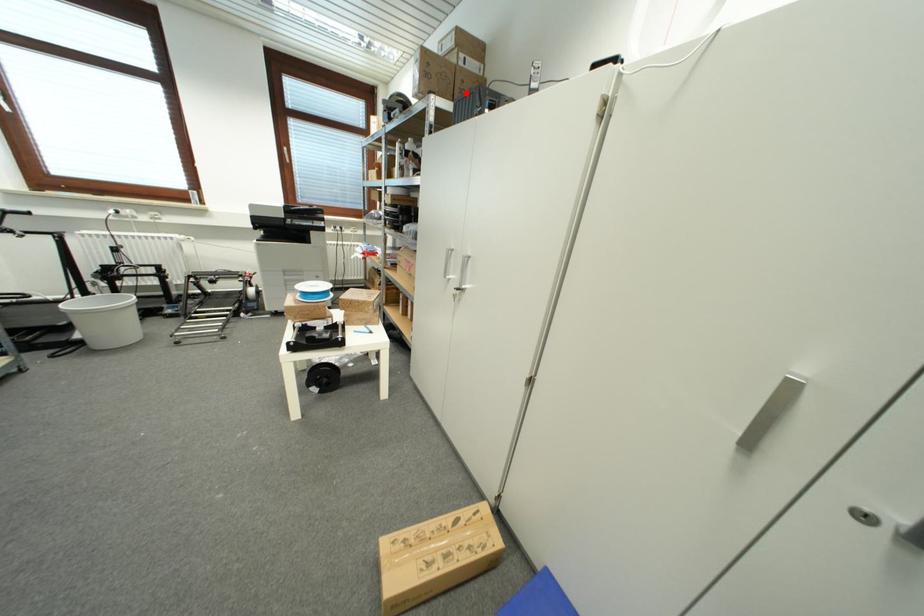
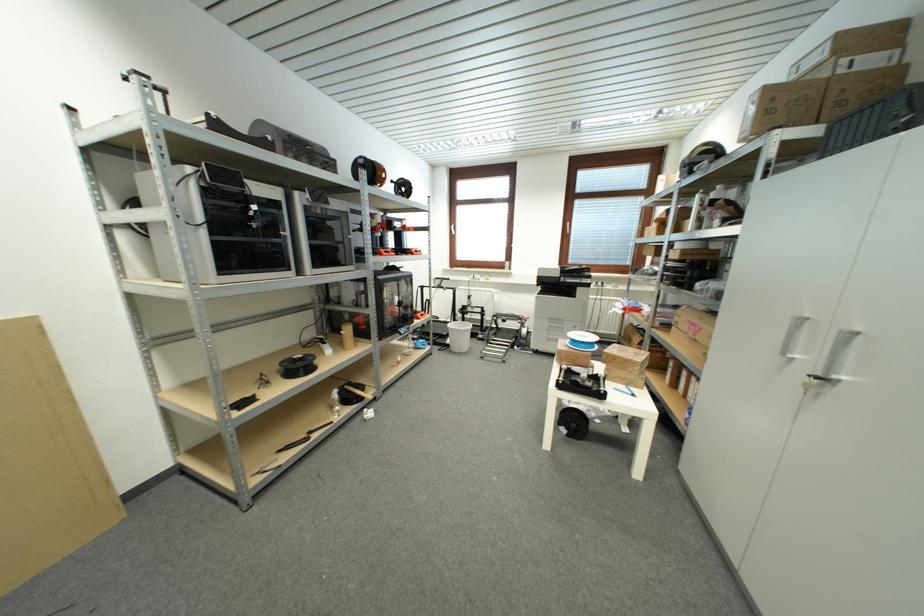
Locate, in the second image, the point that corresponds to the highlighted location in the first image.

(845, 106)